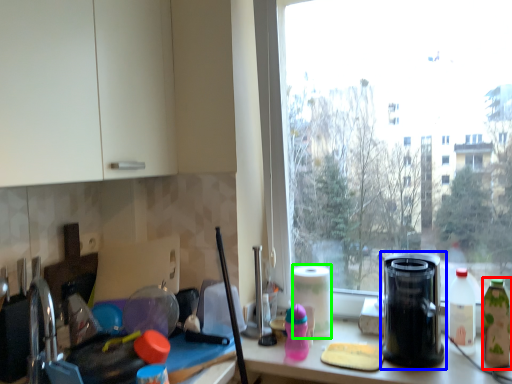
Question: Based on their relative distances, which object is farther from bottle (highlighted by a red box)? Choose from kitchen appliance (highlighted by a blue box) and paper towel (highlighted by a green box).

Choices:
 (A) kitchen appliance
 (B) paper towel

Answer: (B)